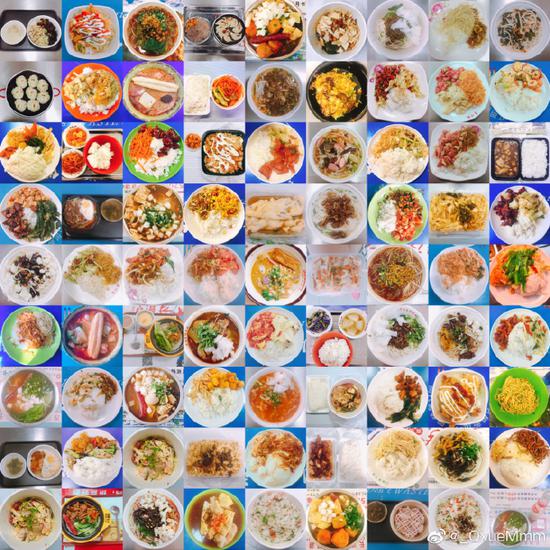
You are a GUI agent. You are given a task and a screenshot of the screen. Output one action in this format:
    pyautogui.click(x=<x>, y=<y>)
    Task: Click on the total dishes in photos on bottom row
    
    Given the screenshot: What is the action you would take?
    pyautogui.click(x=41, y=518), pyautogui.click(x=84, y=522), pyautogui.click(x=140, y=520), pyautogui.click(x=207, y=520), pyautogui.click(x=267, y=516), pyautogui.click(x=338, y=515), pyautogui.click(x=375, y=512), pyautogui.click(x=408, y=514), pyautogui.click(x=456, y=511), pyautogui.click(x=510, y=522)